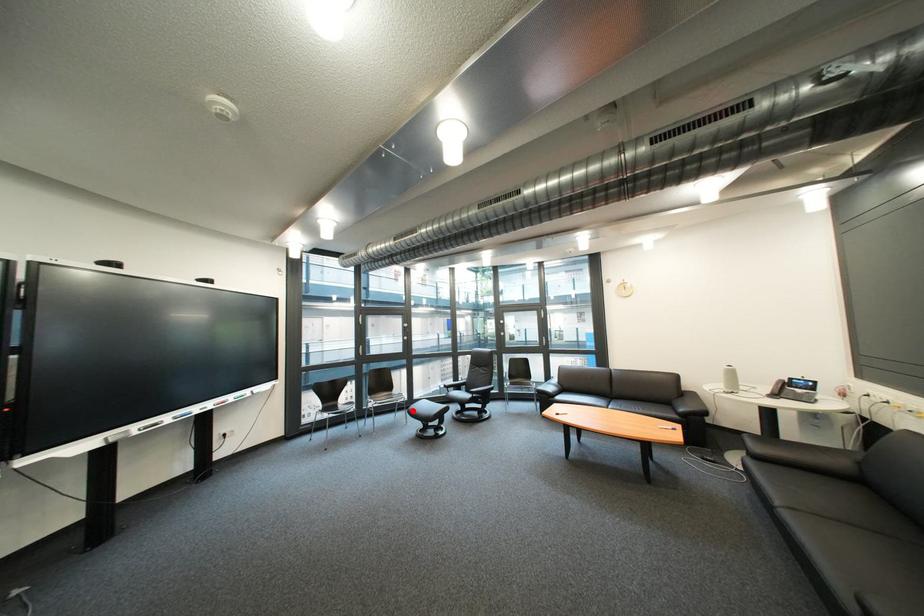
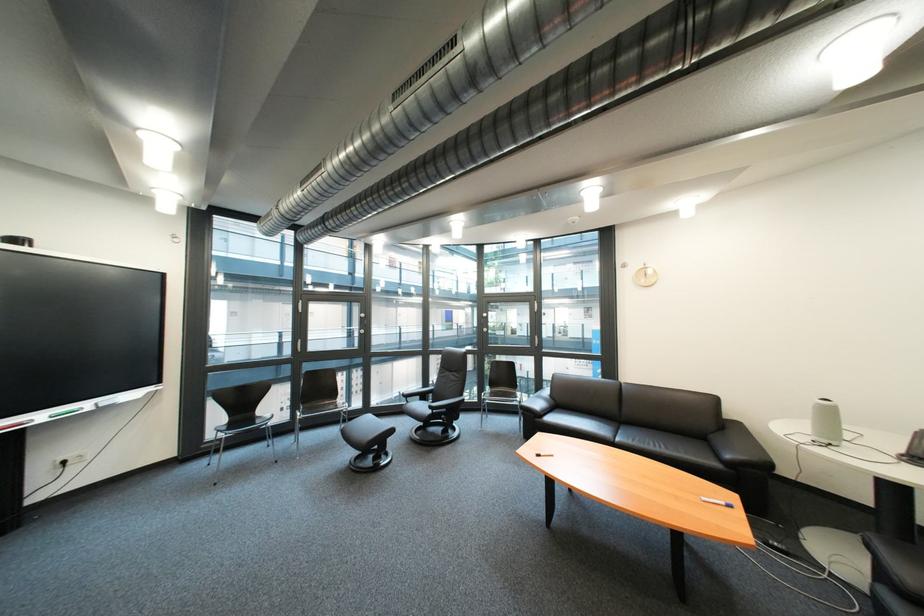
Find the pixel in the second image that matches the highlighted location in the first image.

(359, 424)